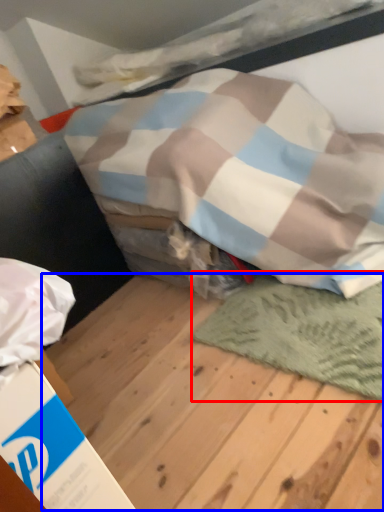
Question: Among these objects, which one is farthest to the camera, mat (highlighted by a red box) or plywood (highlighted by a blue box)?

Choices:
 (A) mat
 (B) plywood

Answer: (A)